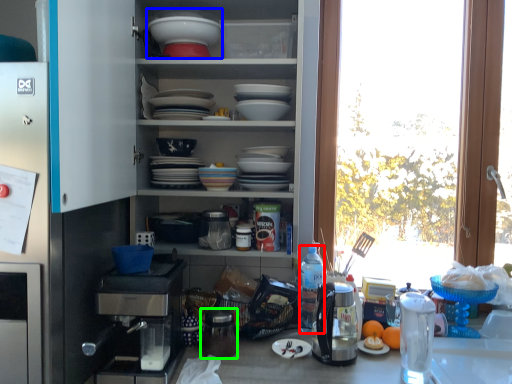
Question: Which is farther away from bottle (highlighted by a red box)? appliance (highlighted by a blue box) or appliance (highlighted by a green box)?

Choices:
 (A) appliance
 (B) appliance

Answer: (A)